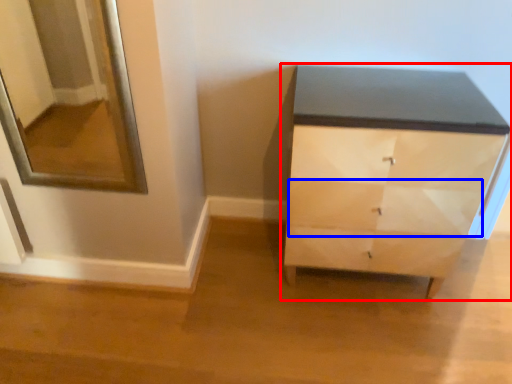
Question: Which point is closer to the camera, chest of drawers (highlighted by a red box) or drawer (highlighted by a blue box)?

Choices:
 (A) chest of drawers
 (B) drawer

Answer: (A)